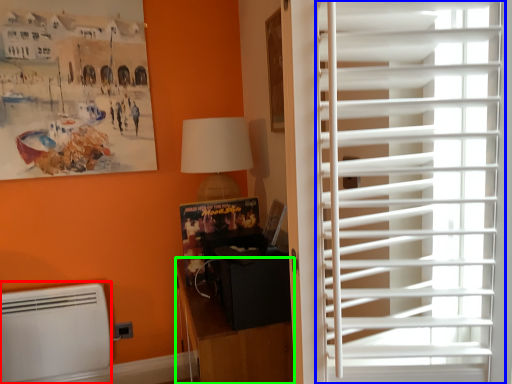
Question: Which is farther away from air conditioning (highlighted by a red box)? window blind (highlighted by a blue box) or furniture (highlighted by a green box)?

Choices:
 (A) window blind
 (B) furniture

Answer: (A)